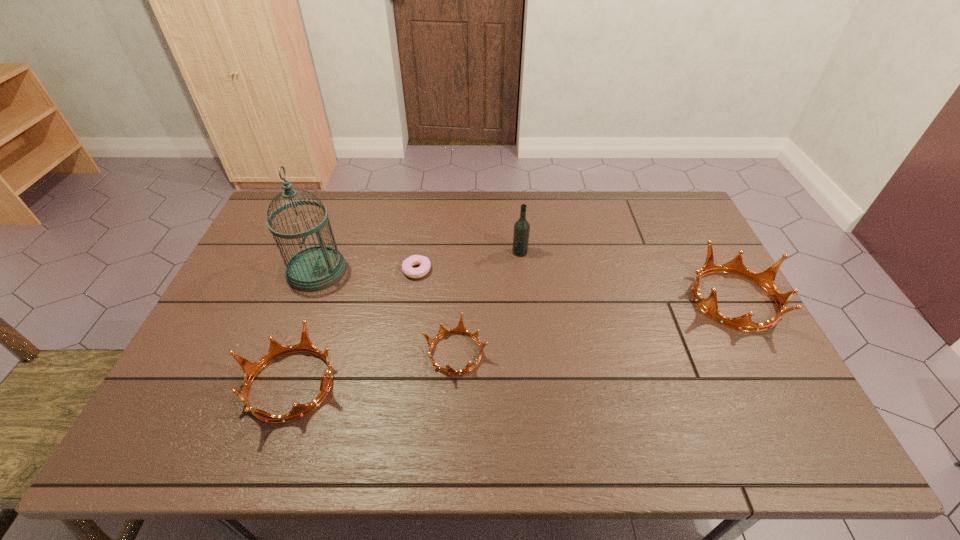
To achieve uniform spacing by inserting another crown among them, please point to a free space for this new crown. Please provide its 2D coordinates. Your answer should be formatted as a tuple, i.e. [(x, y)], where the tuple contains the x and y coordinates of a point satisfying the conditions above.

[(603, 325)]